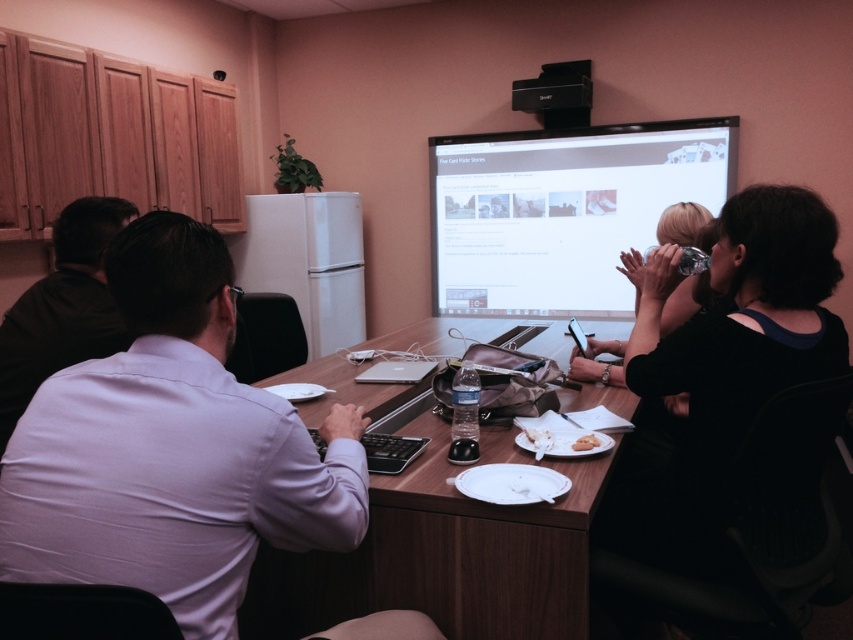
Question: Which point appears closest to the camera in this image?

Choices:
 (A) pyautogui.click(x=585, y=449)
 (B) pyautogui.click(x=193, y=520)
 (C) pyautogui.click(x=453, y=198)
 (D) pyautogui.click(x=381, y=568)

Answer: (B)

Question: Which object is positioned closest to the white matte bread at lower center?

Choices:
 (A) brown wood table at center
 (B) light purple shirt at center

Answer: (A)

Question: Does black matte shirt at right have a smaller size compared to dark gray shirt at left?

Choices:
 (A) yes
 (B) no

Answer: (B)

Question: Does black matte shirt at right have a lesser width compared to white matte bread at lower center?

Choices:
 (A) no
 (B) yes

Answer: (A)

Question: Is brown wood table at center smaller than black matte shirt at right?

Choices:
 (A) yes
 (B) no

Answer: (B)

Question: Which object appears closest to the camera in this image?

Choices:
 (A) matte black shirt at upper right
 (B) brown wood table at center

Answer: (B)